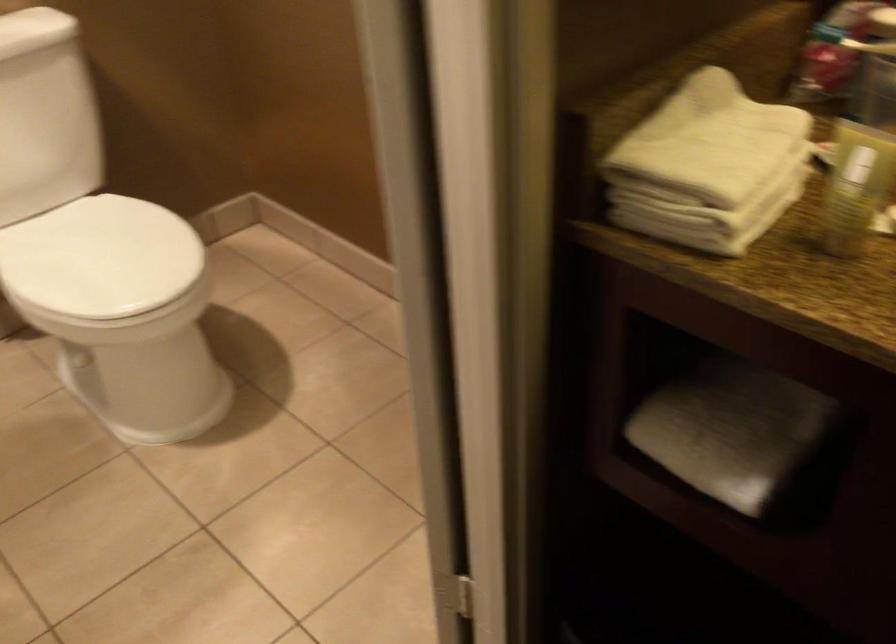
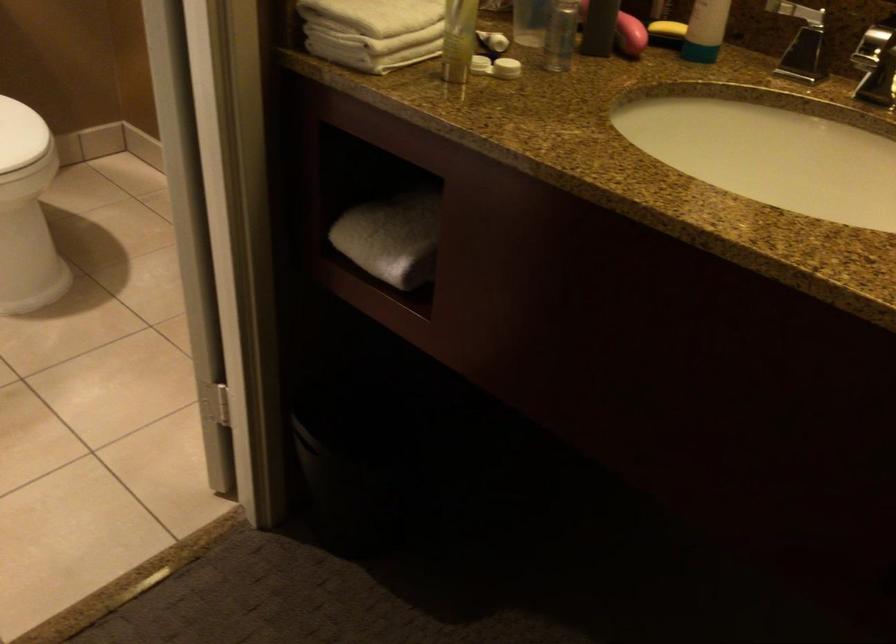
In the second image, find the point that corresponds to point (170, 254) in the first image.

(20, 135)